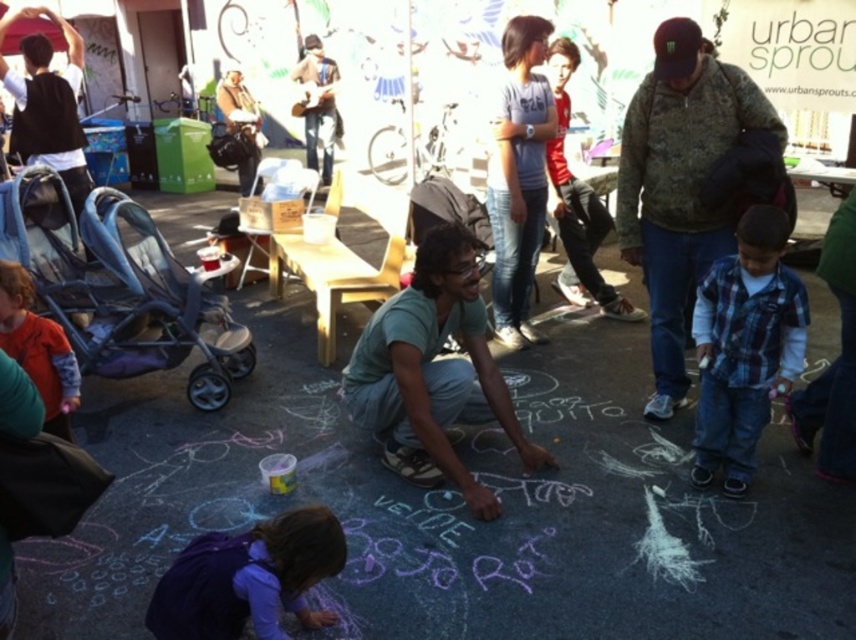
You are a photographer trying to capture a photo that includes both the plaid flannel shirt at lower right and the orange fleece jacket at left. Which clothing item should you adjust your camera angle to focus on first to ensure both are in the frame?

The plaid flannel shirt at lower right is taller than the orange fleece jacket at left, so you should focus on the plaid flannel shirt at lower right first to ensure both are in the frame.

You are a photographer at the event and want to capture both the plaid flannel shirt at lower right and the orange fleece jacket at left in a single frame. Given their sizes, which one might you need to position closer to the camera to ensure both are clearly visible?

The plaid flannel shirt at lower right is bigger than the orange fleece jacket at left, so you should position the orange fleece jacket at left closer to the camera to ensure both are clearly visible.